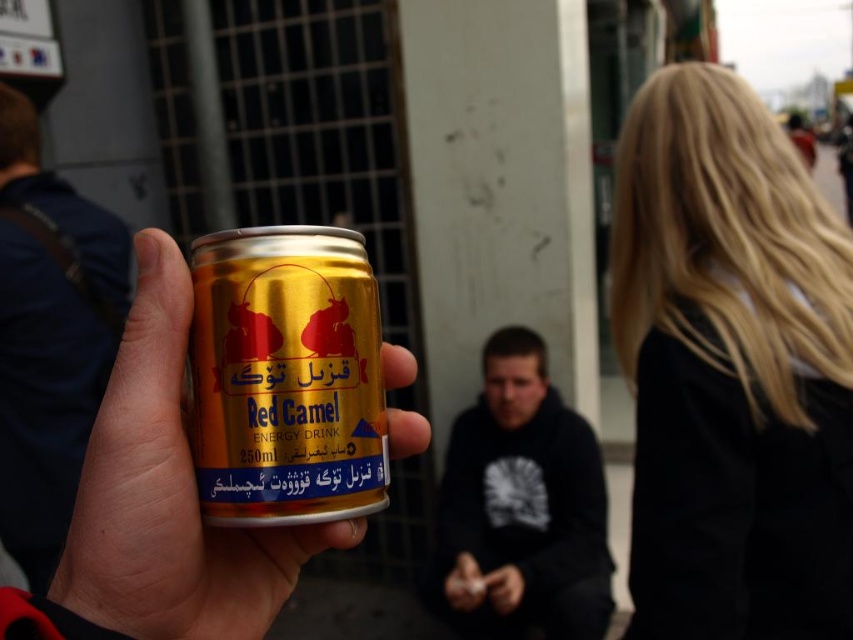
Question: Is gold metallic can at center bigger than dark blue hoodie at center?

Choices:
 (A) yes
 (B) no

Answer: (B)

Question: Which point is farther to the camera?

Choices:
 (A) (265, 502)
 (B) (711, 532)
 (C) (498, 339)
 (D) (71, 442)

Answer: (C)

Question: Which point is farther from the camera taking this photo?

Choices:
 (A) (x=120, y=365)
 (B) (x=744, y=125)
 (C) (x=108, y=230)
 (D) (x=548, y=452)

Answer: (D)

Question: Based on their relative distances, which object is farther from the gold metallic can at center?

Choices:
 (A) dark blue hoodie at center
 (B) dark blue fabric shirt at center

Answer: (A)

Question: Does blonde hair at upper right have a larger size compared to dark blue hoodie at center?

Choices:
 (A) yes
 (B) no

Answer: (A)

Question: Is gold metallic can at center below dark blue hoodie at center?

Choices:
 (A) no
 (B) yes

Answer: (A)